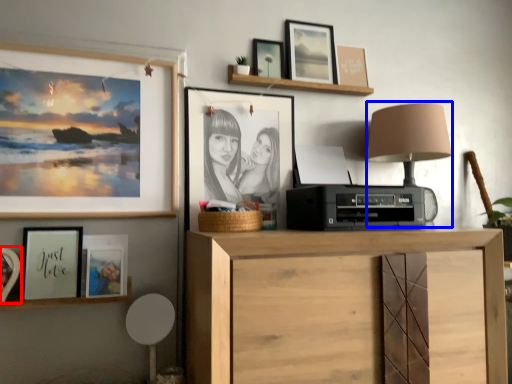
Question: Which object is closer to the camera taking this photo, picture frame (highlighted by a red box) or table lamp (highlighted by a blue box)?

Choices:
 (A) picture frame
 (B) table lamp

Answer: (A)